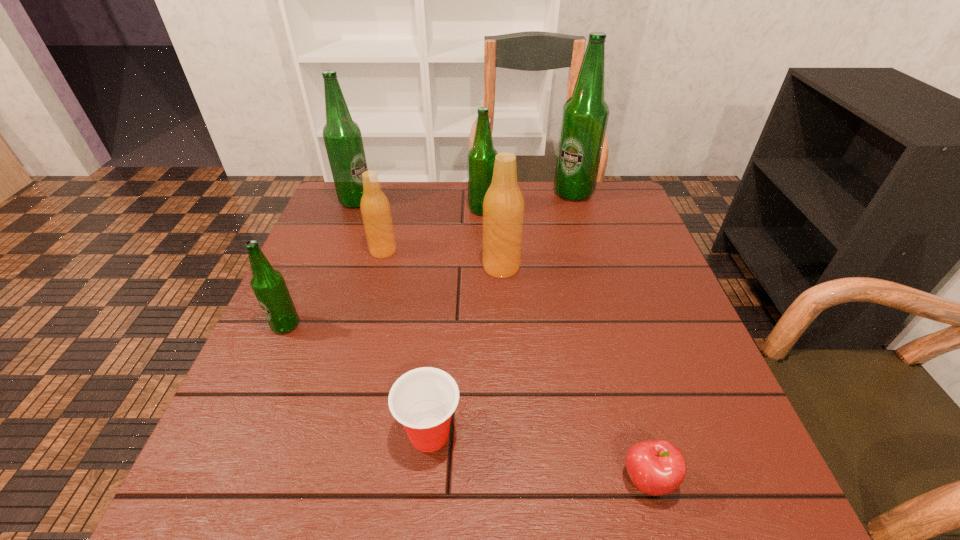
The height and width of the screenshot is (540, 960). I want to click on free spot located on the right of the fourth beer bottle from right to left, so click(x=462, y=251).

I want to click on vacant space located 0.220m on the label of the nearest green beer bottle, so click(239, 431).

Image resolution: width=960 pixels, height=540 pixels. In order to click on free space located 0.220m on the right of the red cup in this screenshot , I will do `click(587, 434)`.

This screenshot has height=540, width=960. In order to click on vacant area situated 0.370m on the back of the shortest object in this screenshot , I will do `click(597, 302)`.

Find the location of `cup situated at the near edge`. cup situated at the near edge is located at coordinates (423, 400).

This screenshot has height=540, width=960. What are the coordinates of `apple at the near edge` in the screenshot? It's located at (657, 467).

At what (x,y) coordinates should I click in order to perform the action: click on beer bottle that is positioned at the right edge. Please return your answer as a coordinate pair (x, y). Looking at the image, I should click on (585, 115).

Find the location of a particular element. Image resolution: width=960 pixels, height=540 pixels. apple located in the right edge section of the desktop is located at coordinates (657, 467).

Locate an element on the screen. This screenshot has height=540, width=960. object positioned at the far left corner is located at coordinates (342, 136).

Image resolution: width=960 pixels, height=540 pixels. Find the location of `object that is at the far right corner`. object that is at the far right corner is located at coordinates (585, 115).